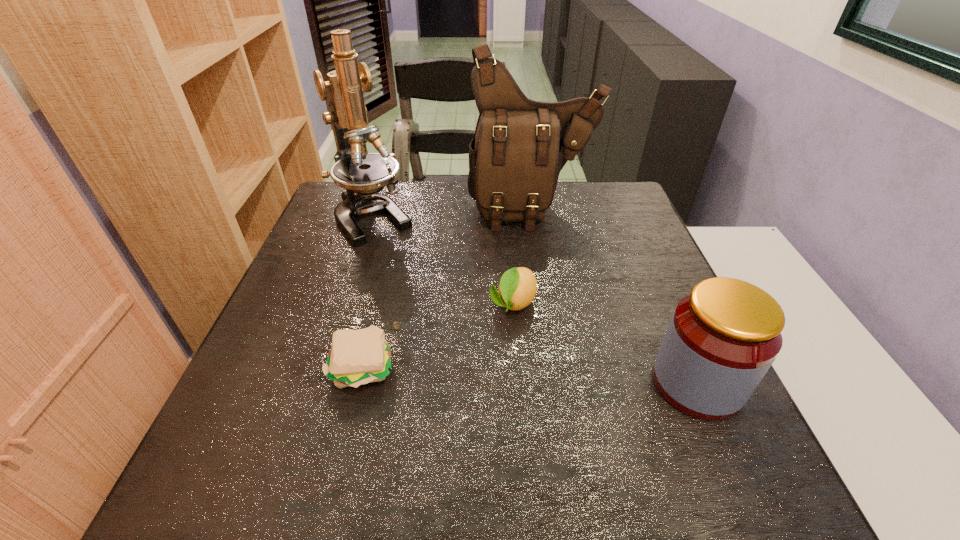
I want to click on free space on the desktop that is between the shortest object and the jar and is positioned at the eyepiece of the microscope, so (508, 374).

Where is `free space on the desktop that is between the patty and the jar and is positioned on the front-facing side of the fourth shortest object`? free space on the desktop that is between the patty and the jar and is positioned on the front-facing side of the fourth shortest object is located at coordinates (573, 377).

Where is `free space on the desktop that is between the shortest object and the third tallest object and is positioned with leaves positioned above the lemon`? The width and height of the screenshot is (960, 540). free space on the desktop that is between the shortest object and the third tallest object and is positioned with leaves positioned above the lemon is located at coordinates (478, 373).